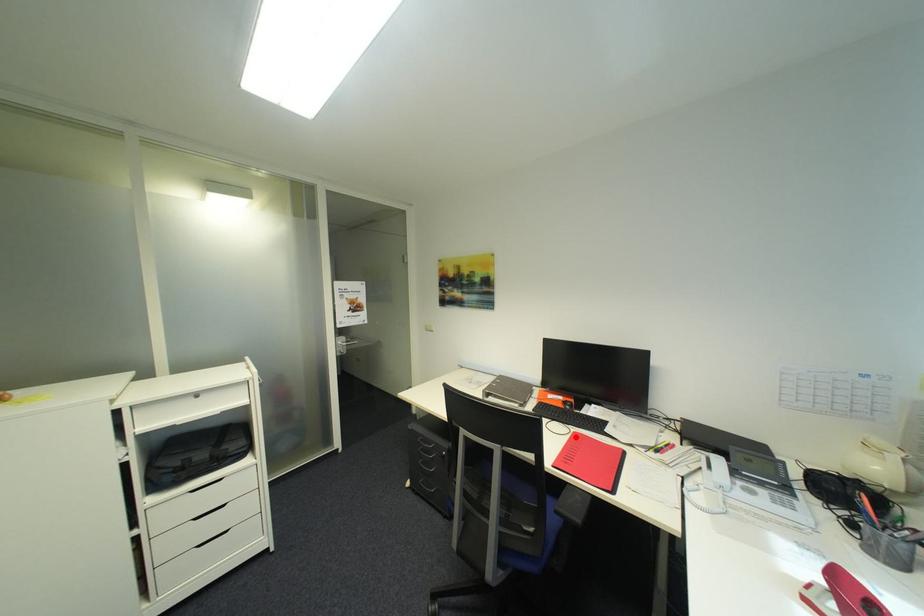
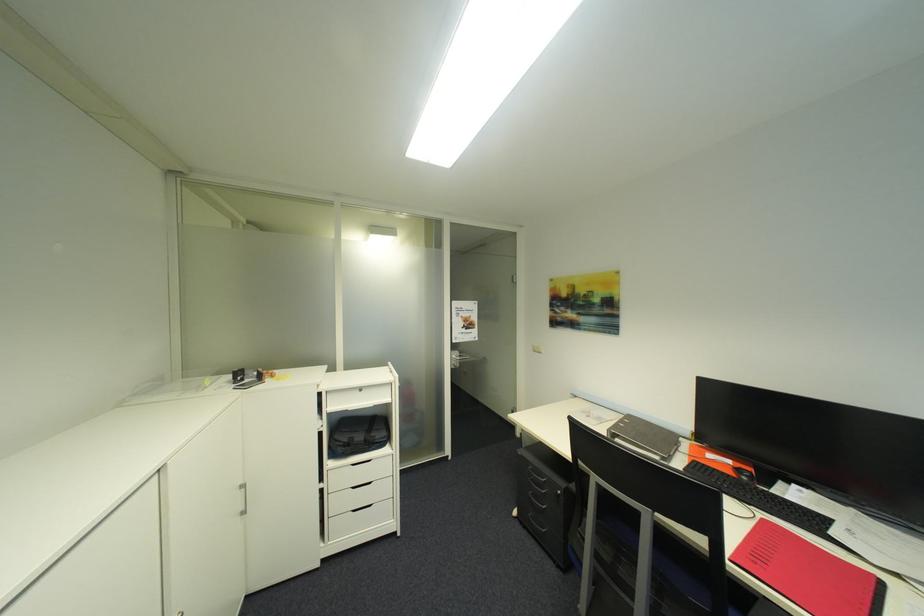
Question: I am providing you with two images of the same scene from different viewpoints. A red point is shown in image1. For the corresponding object point in image2, is it positioned nearer or farther from the camera?

Choices:
 (A) Nearer
 (B) Farther

Answer: (A)